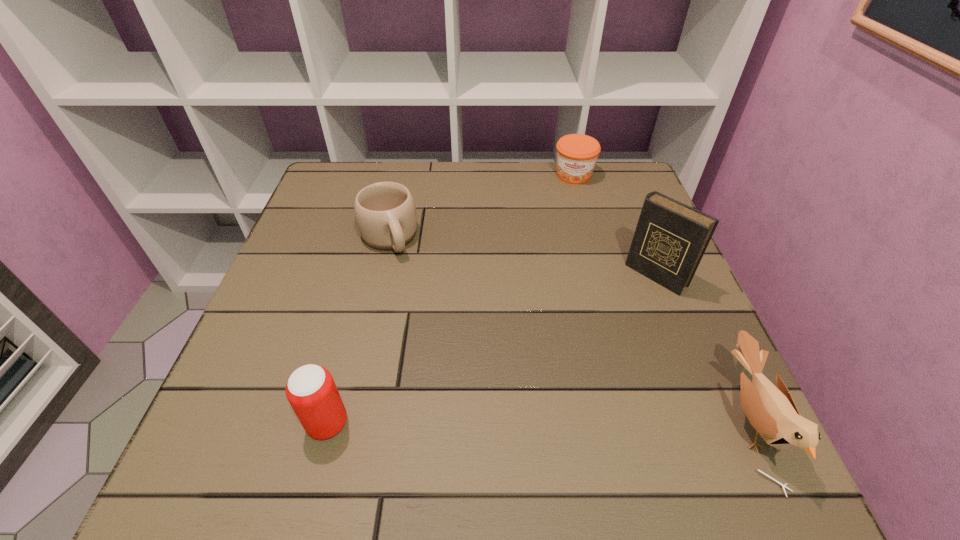
At what (x,y) coordinates should I click in order to perform the action: click on free space on the desktop that is between the beer can and the bird and is positioned on the front cover of the tallest object. Please return your answer as a coordinate pair (x, y). Image resolution: width=960 pixels, height=540 pixels. Looking at the image, I should click on (499, 422).

Where is `vacant spot on the desktop that is between the beer can and the bird and is positioned on the side of the mug with the handle`? vacant spot on the desktop that is between the beer can and the bird and is positioned on the side of the mug with the handle is located at coordinates (477, 422).

The image size is (960, 540). What are the coordinates of `free space on the desktop that is between the beer can and the bird and is positioned on the front label of the third object from left to right` in the screenshot? It's located at (552, 422).